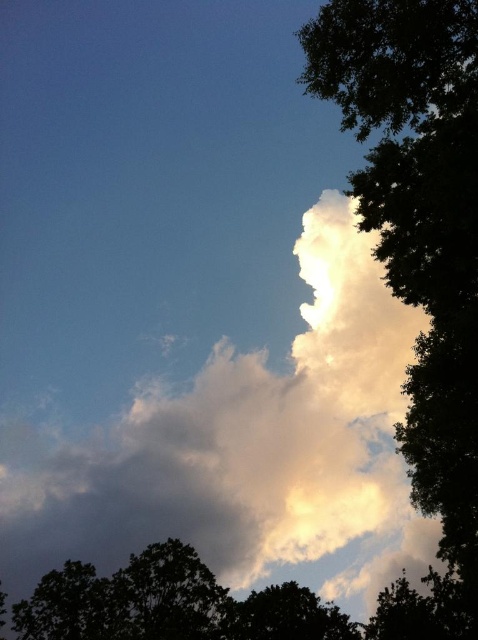
Question: Which object appears closest to the camera in this image?

Choices:
 (A) green leafy tree at upper right
 (B) white fluffy cloud at upper center
 (C) green leafy tree at lower center

Answer: (A)

Question: From the image, what is the correct spatial relationship of green leafy tree at upper right in relation to green leafy tree at lower right?

Choices:
 (A) above
 (B) below

Answer: (A)

Question: Is green leafy tree at upper right smaller than green leafy tree at lower center?

Choices:
 (A) no
 (B) yes

Answer: (A)

Question: Is green leafy tree at upper right positioned in front of green leafy tree at lower center?

Choices:
 (A) no
 (B) yes

Answer: (B)

Question: Which point is farther to the camera?

Choices:
 (A) (317, 628)
 (B) (252, 483)
 (C) (76, 628)
 (D) (344, 42)

Answer: (B)

Question: Which point is farther to the camera?

Choices:
 (A) green leafy tree at lower center
 (B) green leafy tree at upper right

Answer: (A)